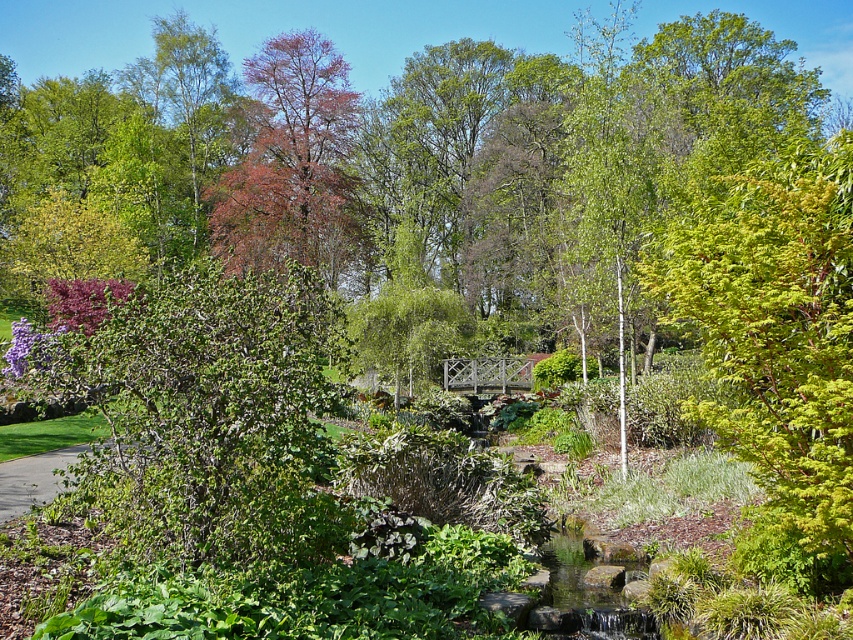
Question: Which object appears farthest from the camera in this image?

Choices:
 (A) green grass at lower left
 (B) green leafy bush at center

Answer: (A)

Question: Can you confirm if green leafy bush at center is bigger than green grass at lower left?

Choices:
 (A) yes
 (B) no

Answer: (A)

Question: Can you confirm if green leafy bush at center is wider than green grass at lower left?

Choices:
 (A) yes
 (B) no

Answer: (A)

Question: Which of the following is the farthest from the observer?

Choices:
 (A) (36, 493)
 (B) (260, 476)

Answer: (A)

Question: Which point is closer to the camera?

Choices:
 (A) (38, 483)
 (B) (167, 419)

Answer: (B)

Question: Is green leafy bush at center wider than green grass at lower left?

Choices:
 (A) yes
 (B) no

Answer: (A)